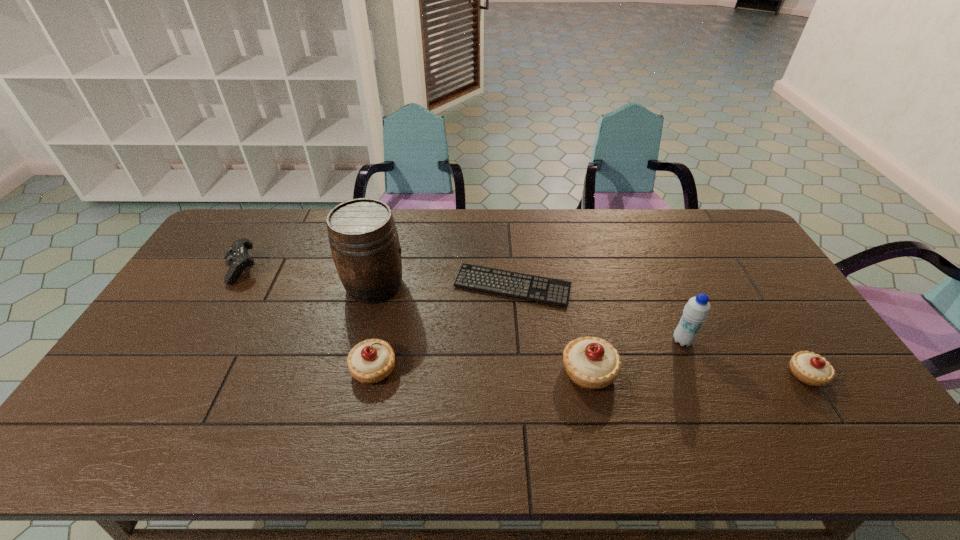
You are a GUI agent. You are given a task and a screenshot of the screen. Output one action in this format:
    pyautogui.click(x=<x>, y=<y>)
    Task: Click on the free space that satisfies the following two spatial constraints: 1. on the side of the cider near the bung hole; 2. on the left side of the rightmost pastry
    The height and width of the screenshot is (540, 960).
    Given the screenshot: What is the action you would take?
    pyautogui.click(x=352, y=374)